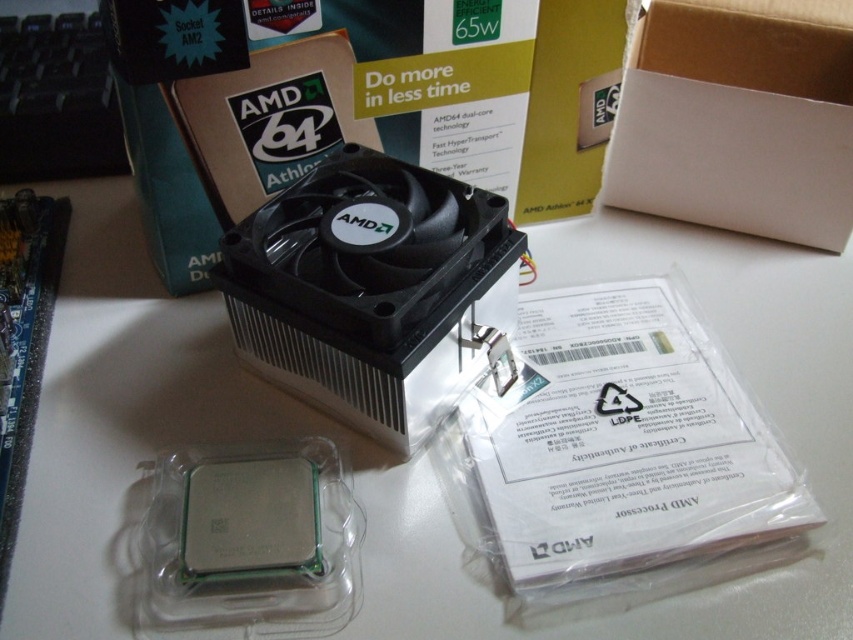
Which of these two, black plastic fan at center or white cardboard box at upper center, stands shorter?

white cardboard box at upper center is shorter.

Does black plastic fan at center appear over white cardboard box at upper center?

Actually, black plastic fan at center is below white cardboard box at upper center.

This screenshot has height=640, width=853. Find the location of `black plastic fan at center`. black plastic fan at center is located at coordinates (372, 289).